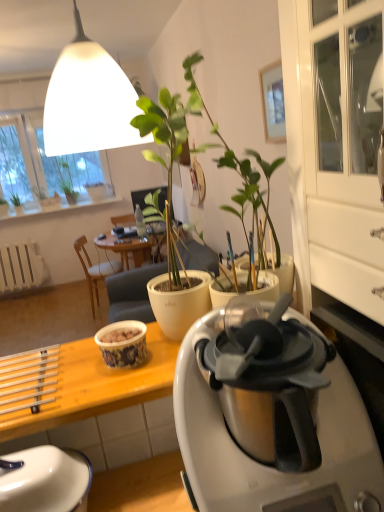
Image resolution: width=384 pixels, height=512 pixels. Identify the location of vacant space in front of matte ceramic cup at center. (115, 387).